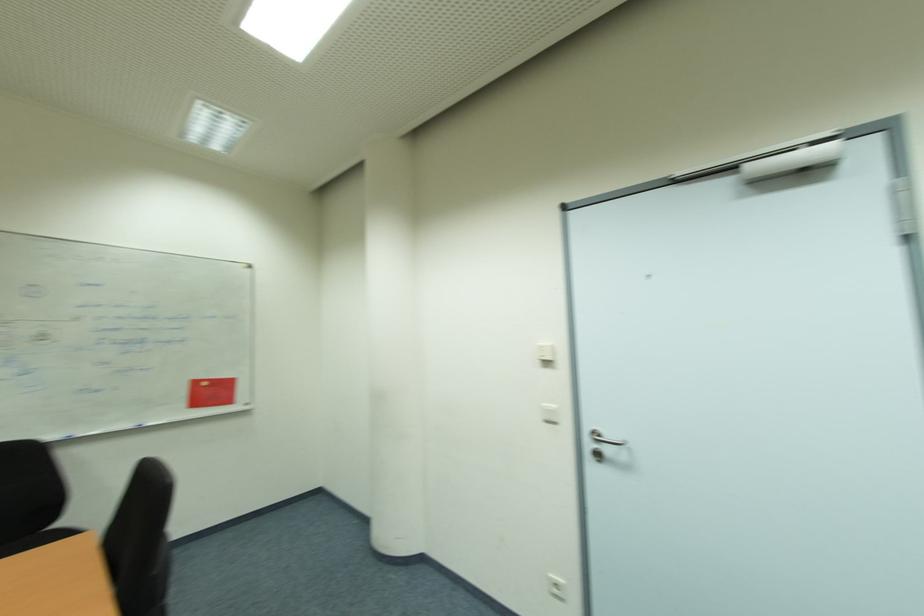
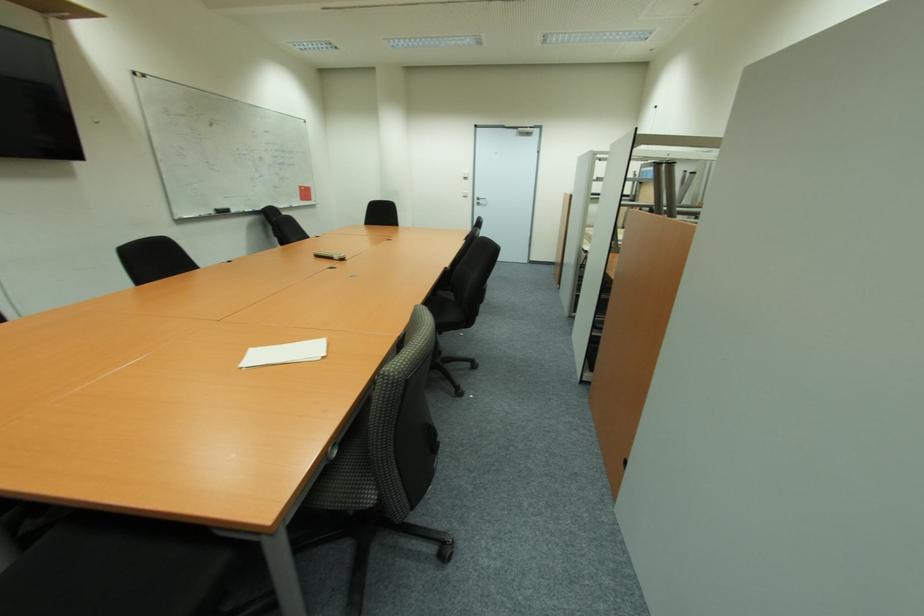
Find the pixel in the second image that matches (x=542, y=363) in the first image.

(467, 179)